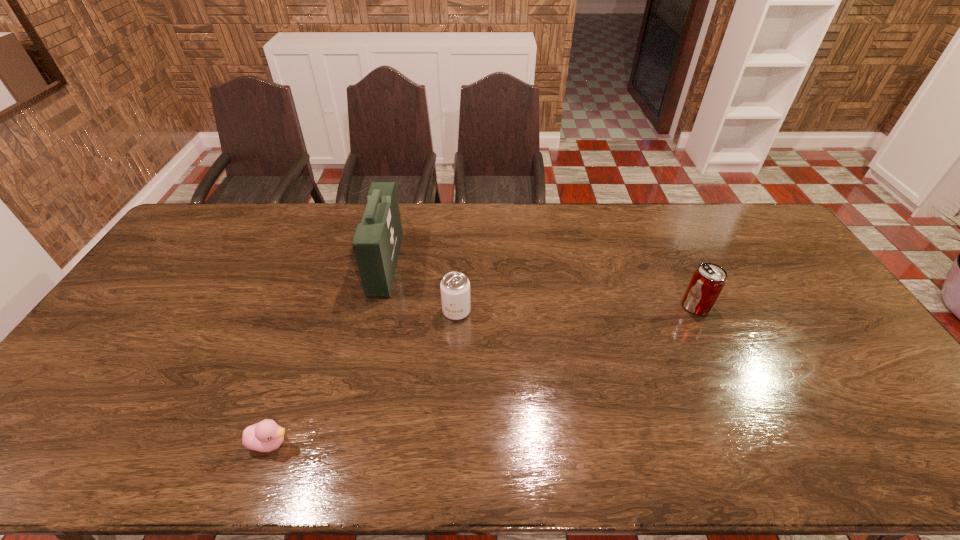
Locate an element on the screen. The width and height of the screenshot is (960, 540). object present at the far edge is located at coordinates [377, 240].

What are the coordinates of `object located at the near edge` in the screenshot? It's located at (265, 436).

The image size is (960, 540). Find the location of `vacant region at the far edge`. vacant region at the far edge is located at coordinates (319, 235).

The image size is (960, 540). What are the coordinates of `vacant space at the left edge of the desktop` in the screenshot? It's located at (96, 363).

The width and height of the screenshot is (960, 540). In the image, there is a desktop. Identify the location of free space at the far left corner. (215, 224).

The height and width of the screenshot is (540, 960). I want to click on vacant space at the near right corner of the desktop, so click(x=914, y=451).

Identify the location of vacant region between the first-aid kit and the left soda can. click(421, 287).

This screenshot has height=540, width=960. Find the location of `unoccupied area between the rightmost object and the third object from right to left`. unoccupied area between the rightmost object and the third object from right to left is located at coordinates (540, 285).

Find the location of `free space between the second object from right to left and the tallest object`. free space between the second object from right to left and the tallest object is located at coordinates (421, 287).

Locate an element on the screen. free space that is in between the second object from right to left and the tallest object is located at coordinates (421, 287).